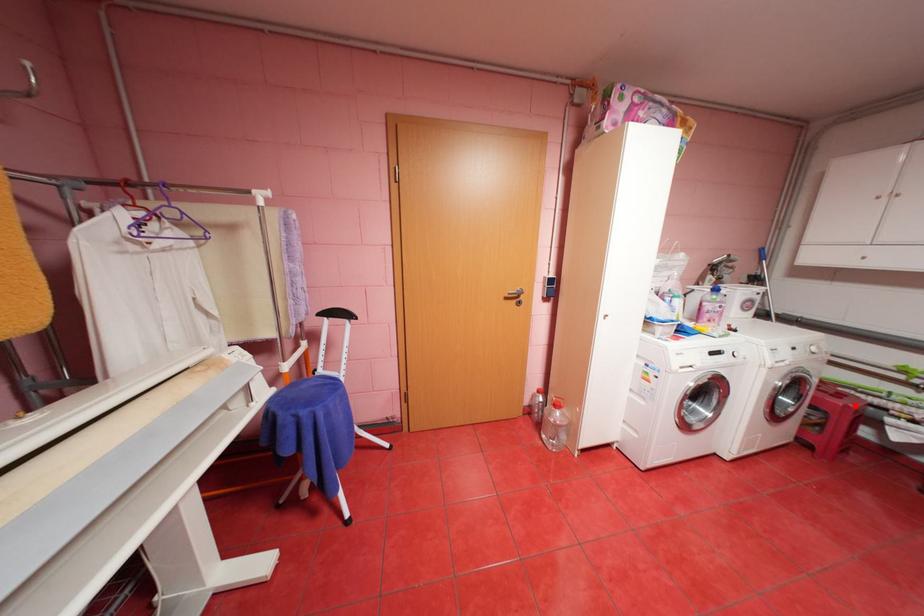
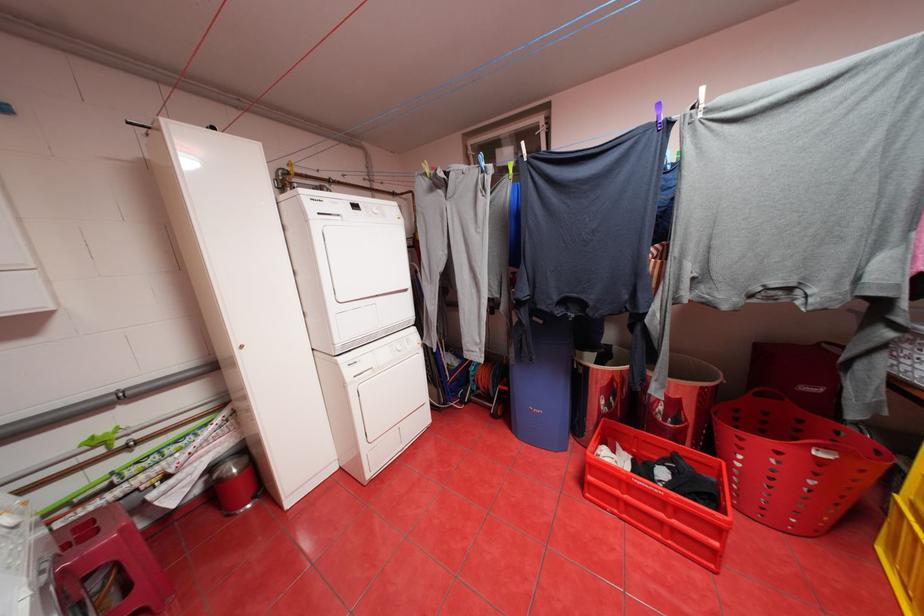
Find the pixel in the second image that matches the highlighted location in the first image.

(130, 530)